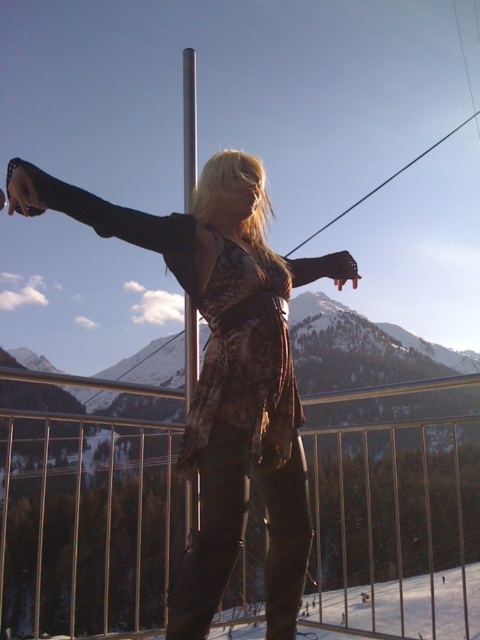
Question: Which point appears closest to the camera in this image?

Choices:
 (A) (188, 513)
 (B) (67, 209)
 (C) (108, 515)

Answer: (A)

Question: Which point is farther to the camera?

Choices:
 (A) (194, 76)
 (B) (372, 444)
 (C) (296, 396)

Answer: (B)

Question: Does metallic silver railing at center have a greater width compared to matte black dress at center?

Choices:
 (A) no
 (B) yes

Answer: (B)

Question: Can you confirm if metallic silver railing at center is positioned to the left of silver metallic pole at center?

Choices:
 (A) yes
 (B) no

Answer: (B)

Question: Considering the relative positions of metallic silver railing at center and matte black dress at center in the image provided, where is metallic silver railing at center located with respect to matte black dress at center?

Choices:
 (A) left
 (B) right

Answer: (A)

Question: Which object is farther from the camera taking this photo?

Choices:
 (A) matte black dress at center
 (B) silver metallic pole at center

Answer: (B)